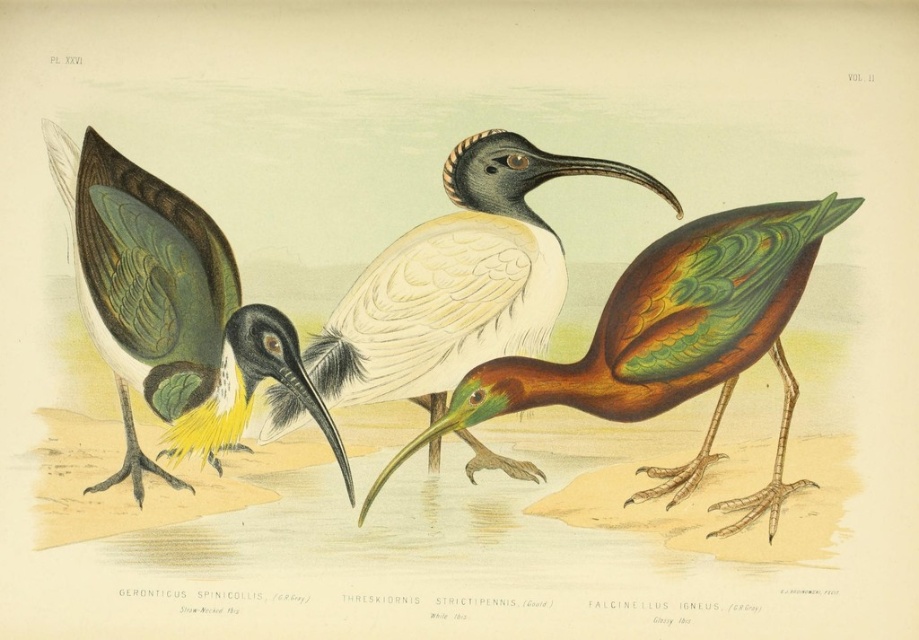
Is point (664, 301) closer to viewer compared to point (331, 403)?

Yes, it is.

This screenshot has width=919, height=640. In order to click on multicolored glossy ibis at center in this screenshot , I will do click(672, 340).

Image resolution: width=919 pixels, height=640 pixels. I want to click on multicolored glossy ibis at center, so click(x=672, y=340).

Does point (790, 310) come farther from viewer compared to point (151, 275)?

No, it is not.

Which is behind, point (715, 253) or point (244, 371)?

Point (244, 371)

At what (x,y) coordinates should I click in order to perform the action: click on multicolored glossy ibis at center. Please return your answer as a coordinate pair (x, y). The height and width of the screenshot is (640, 919). Looking at the image, I should click on (672, 340).

Can you confirm if white feathered bird at center is thinner than green glossy feathers at center?

No.

The height and width of the screenshot is (640, 919). What do you see at coordinates (457, 282) in the screenshot? I see `white feathered bird at center` at bounding box center [457, 282].

Identify the location of white feathered bird at center. The height and width of the screenshot is (640, 919). (457, 282).